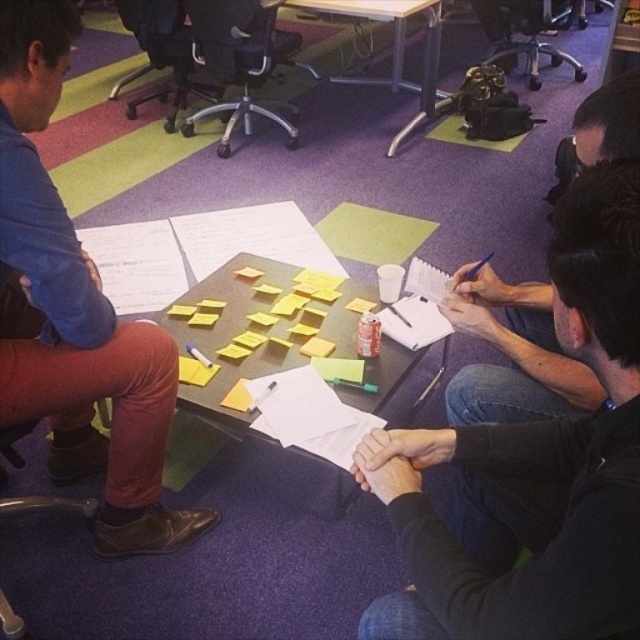
Does matte blue shirt at left have a greater width compared to yellow sticky notes at center?

No, matte blue shirt at left is not wider than yellow sticky notes at center.

What do you see at coordinates (76, 312) in the screenshot? Image resolution: width=640 pixels, height=640 pixels. I see `matte blue shirt at left` at bounding box center [76, 312].

This screenshot has width=640, height=640. Find the location of `matte blue shirt at left`. matte blue shirt at left is located at coordinates (76, 312).

Is point (262, 272) farther from camera compared to point (380, 8)?

No, it is in front of (380, 8).

In the scene shown: Does yellow sticky notes at center have a lesser height compared to wooden table at center?

Indeed, yellow sticky notes at center has a lesser height compared to wooden table at center.

What do you see at coordinates (228, 300) in the screenshot?
I see `yellow sticky notes at center` at bounding box center [228, 300].

This screenshot has width=640, height=640. What are the coordinates of `yellow sticky notes at center` in the screenshot? It's located at (228, 300).

Is black matte shirt at center positioned before wooden table at center?

Yes, it is in front of wooden table at center.

Can you confirm if black matte shirt at center is shorter than wooden table at center?

Yes.

The height and width of the screenshot is (640, 640). What do you see at coordinates (536, 465) in the screenshot? I see `black matte shirt at center` at bounding box center [536, 465].

In order to click on black matte shirt at center in this screenshot , I will do (536, 465).